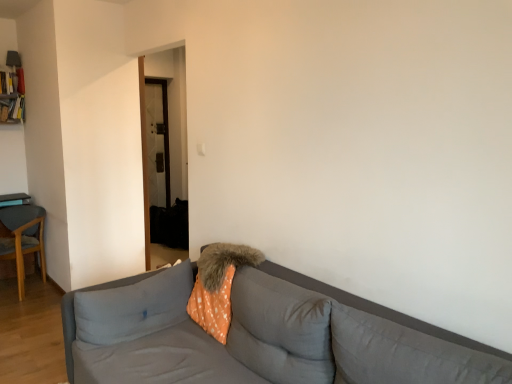
Question: Does gray fabric couch at center have a smaller size compared to orange polka dot fabric at center?

Choices:
 (A) yes
 (B) no

Answer: (B)

Question: Is gray fabric couch at center facing towards orange polka dot fabric at center?

Choices:
 (A) yes
 (B) no

Answer: (A)

Question: Can you confirm if gray fabric couch at center is taller than orange polka dot fabric at center?

Choices:
 (A) no
 (B) yes

Answer: (B)

Question: Is gray fabric couch at center located outside orange polka dot fabric at center?

Choices:
 (A) yes
 (B) no

Answer: (A)

Question: Is gray fabric couch at center positioned far away from orange polka dot fabric at center?

Choices:
 (A) yes
 (B) no

Answer: (B)

Question: From a real-world perspective, is gray fabric pillow at lower right, marked as the first pillow in a right-to-left arrangement, physically located above or below wooden chair at left?

Choices:
 (A) below
 (B) above

Answer: (B)

Question: Is gray fabric pillow at lower right, marked as the fourth pillow in a left-to-right arrangement, spatially inside wooden chair at left, or outside of it?

Choices:
 (A) outside
 (B) inside

Answer: (A)

Question: Considering their positions, is gray fabric pillow at lower right, marked as the fourth pillow in a left-to-right arrangement, located in front of or behind wooden chair at left?

Choices:
 (A) behind
 (B) front

Answer: (B)

Question: Considering the positions of point (399, 337) and point (9, 206), is point (399, 337) closer or farther from the camera than point (9, 206)?

Choices:
 (A) farther
 (B) closer

Answer: (B)

Question: From a real-world perspective, relative to wooden chair at left, is orange polka dot pillow at center, which is the 3th pillow from left to right, vertically above or below?

Choices:
 (A) above
 (B) below

Answer: (A)

Question: In terms of height, does orange polka dot pillow at center, which ranks as the 2th pillow in right-to-left order, look taller or shorter compared to wooden chair at left?

Choices:
 (A) short
 (B) tall

Answer: (A)

Question: Relative to wooden chair at left, is orange polka dot pillow at center, which is the 3th pillow from left to right, in front or behind?

Choices:
 (A) front
 (B) behind

Answer: (A)

Question: Is point (310, 329) positioned closer to the camera than point (14, 205)?

Choices:
 (A) closer
 (B) farther

Answer: (A)

Question: Is fuzzy orange pillow at center, placed as the 3th pillow when sorted from right to left, inside the boundaries of orange polka dot pillow at center, the first pillow when ordered from left to right, or outside?

Choices:
 (A) outside
 (B) inside

Answer: (A)

Question: In terms of size, does fuzzy orange pillow at center, placed as the 3th pillow when sorted from right to left, appear bigger or smaller than orange polka dot pillow at center, the fourth pillow in the right-to-left sequence?

Choices:
 (A) big
 (B) small

Answer: (B)